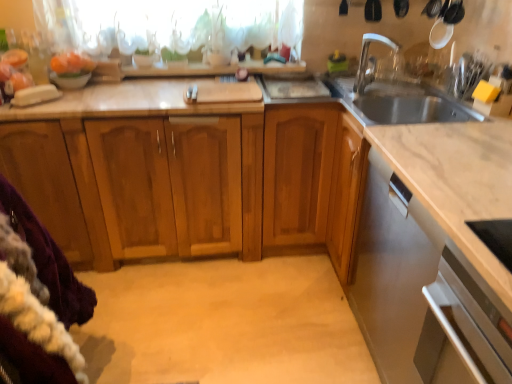
Locate an element on the screen. The image size is (512, 384). white glossy faucet at upper right is located at coordinates (370, 61).

What is the approximate width of satin silver dishwasher at lower right?

It is 24.74 inches.

Describe the element at coordinates (72, 64) in the screenshot. Image resolution: width=512 pixels, height=384 pixels. I see `orange matte bowl at upper left` at that location.

This screenshot has height=384, width=512. I want to click on satin silver oven at lower right, so click(x=463, y=326).

Measure the distance between point (85,78) and camera.

Point (85,78) is 6.34 feet away from camera.

The image size is (512, 384). In order to click on white glossy faucet at upper right in this screenshot , I will do `click(370, 61)`.

From the image's perspective, is orange matte bowl at upper left positioned above or below translucent fabric at upper center?

orange matte bowl at upper left is situated lower than translucent fabric at upper center in the image.

Looking at this image, which of these two, orange matte bowl at upper left or translucent fabric at upper center, is thinner?

translucent fabric at upper center is thinner.

Between orange matte bowl at upper left and translucent fabric at upper center, which one is positioned in front?

Positioned in front is orange matte bowl at upper left.

Is satin silver dishwasher at lower right directly adjacent to purple fleece blanket at lower left?

satin silver dishwasher at lower right is not next to purple fleece blanket at lower left, and they're not touching.

From the image's perspective, relative to purple fleece blanket at lower left, is satin silver dishwasher at lower right above or below?

Based on their image positions, satin silver dishwasher at lower right is located above purple fleece blanket at lower left.

Who is bigger, satin silver dishwasher at lower right or purple fleece blanket at lower left?

Bigger between the two is satin silver dishwasher at lower right.

Consider the image. Does satin silver dishwasher at lower right have a lesser height compared to purple fleece blanket at lower left?

Yes.

Would you say purple fleece blanket at lower left is inside or outside wooden cabinets at center?

purple fleece blanket at lower left is spatially situated outside wooden cabinets at center.

Are purple fleece blanket at lower left and wooden cabinets at center located far from each other?

purple fleece blanket at lower left is actually quite close to wooden cabinets at center.

Looking at this image, is purple fleece blanket at lower left closer to camera compared to wooden cabinets at center?

Yes, it is in front of wooden cabinets at center.

Does purple fleece blanket at lower left appear on the right side of wooden cabinets at center?

Incorrect, purple fleece blanket at lower left is not on the right side of wooden cabinets at center.

From the image's perspective, is satin silver oven at lower right located beneath white glossy faucet at upper right?

Yes, from the image's perspective, satin silver oven at lower right is beneath white glossy faucet at upper right.

From a real-world perspective, who is located higher, satin silver oven at lower right or white glossy faucet at upper right?

white glossy faucet at upper right is physically above.

Measure the distance between satin silver oven at lower right and white glossy faucet at upper right.

satin silver oven at lower right is 3.98 feet away from white glossy faucet at upper right.

Who is more distant, satin silver oven at lower right or white glossy faucet at upper right?

white glossy faucet at upper right.

Looking at the image, does white glossy faucet at upper right seem bigger or smaller compared to translucent fabric at upper center?

Clearly, white glossy faucet at upper right is smaller in size than translucent fabric at upper center.

Which point is more distant from viewer, (376, 63) or (186, 39)?

The point (376, 63) is farther.

Is the depth of white glossy faucet at upper right less than that of translucent fabric at upper center?

Yes, white glossy faucet at upper right is closer to the viewer.

Which object is thinner, white glossy faucet at upper right or translucent fabric at upper center?

Thinner between the two is translucent fabric at upper center.

How much distance is there between satin silver oven at lower right and wooden cabinets at center?

satin silver oven at lower right is 1.01 meters from wooden cabinets at center.

Considering the sizes of objects satin silver oven at lower right and wooden cabinets at center in the image provided, who is wider, satin silver oven at lower right or wooden cabinets at center?

wooden cabinets at center.

From the image's perspective, is satin silver oven at lower right above wooden cabinets at center?

No, from the image's perspective, satin silver oven at lower right is not on top of wooden cabinets at center.

Relative to wooden cabinets at center, is satin silver oven at lower right in front or behind?

In the image, satin silver oven at lower right appears in front of wooden cabinets at center.

Is white glossy bowl at upper left further to the viewer compared to satin silver oven at lower right?

Yes, white glossy bowl at upper left is further from the camera.

Consider the image. Can you confirm if white glossy bowl at upper left is taller than satin silver oven at lower right?

No.

Is white glossy bowl at upper left facing towards satin silver oven at lower right?

No, white glossy bowl at upper left is not aimed at satin silver oven at lower right.

Does white glossy bowl at upper left appear on the left side of satin silver oven at lower right?

Yes, white glossy bowl at upper left is to the left of satin silver oven at lower right.

Locate an element on the screen. window screen above the orange matte bowl at upper left (from a real-world perspective) is located at coordinates (156, 24).

Find the location of a particular element. This screenshot has height=384, width=512. blanket on the left of satin silver dishwasher at lower right is located at coordinates (38, 299).

Based on their spatial positions, is satin silver oven at lower right or white glossy bowl at upper left further from wooden cabinets at center?

satin silver oven at lower right.

Based on their spatial positions, is translucent fabric at upper center or satin silver oven at lower right further from orange matte bowl at upper left?

satin silver oven at lower right is positioned further to the anchor orange matte bowl at upper left.

Estimate the real-world distances between objects in this image. Which object is closer to wooden cabinets at center, orange matte bowl at upper left or translucent fabric at upper center?

Result: translucent fabric at upper center lies closer to wooden cabinets at center than the other object.

Based on their spatial positions, is satin silver oven at lower right or white glossy faucet at upper right closer to satin silver dishwasher at lower right?

satin silver oven at lower right.

From the image, which object appears to be nearer to satin silver oven at lower right, white glossy bowl at upper left or white glossy faucet at upper right?

white glossy faucet at upper right is positioned closer to the anchor satin silver oven at lower right.

Estimate the real-world distances between objects in this image. Which object is closer to satin silver oven at lower right, white glossy faucet at upper right or satin silver dishwasher at lower right?

satin silver dishwasher at lower right is positioned closer to the anchor satin silver oven at lower right.

Considering their positions, is satin silver dishwasher at lower right positioned further to wooden cabinets at center than white glossy faucet at upper right?

white glossy faucet at upper right.

Estimate the real-world distances between objects in this image. Which object is closer to wooden cabinets at center, purple fleece blanket at lower left or satin silver dishwasher at lower right?

satin silver dishwasher at lower right lies closer to wooden cabinets at center than the other object.

Locate an element on the screen. The height and width of the screenshot is (384, 512). oven between wooden cabinets at center and satin silver dishwasher at lower right is located at coordinates (463, 326).

In order to click on tap between wooden cabinets at center and satin silver oven at lower right from left to right in this screenshot , I will do `click(370, 61)`.

Find the location of a particular element. This screenshot has width=512, height=384. tap positioned between purple fleece blanket at lower left and translucent fabric at upper center from near to far is located at coordinates (370, 61).

Locate an element on the screen. Image resolution: width=512 pixels, height=384 pixels. window screen between orange matte bowl at upper left and satin silver oven at lower right in the horizontal direction is located at coordinates (156, 24).